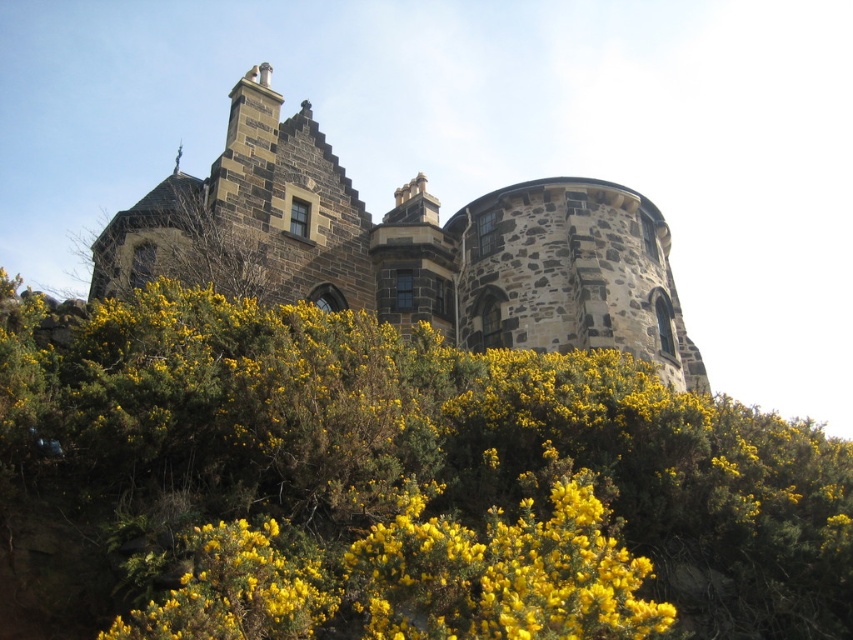
Looking at this image, is the position of yellow-green foliage at center less distant than that of rustic stone castle at center?

Yes, it is.

Who is more distant from viewer, (491, 438) or (236, 99)?

The point (236, 99) is more distant.

Locate an element on the screen. This screenshot has height=640, width=853. yellow-green foliage at center is located at coordinates (393, 484).